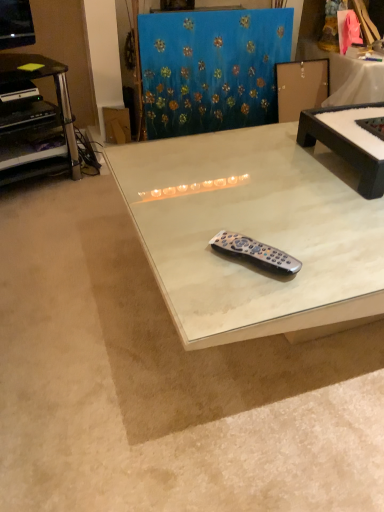
Where is `free area behind black plastic remote at center`? This screenshot has height=512, width=384. free area behind black plastic remote at center is located at coordinates [245, 217].